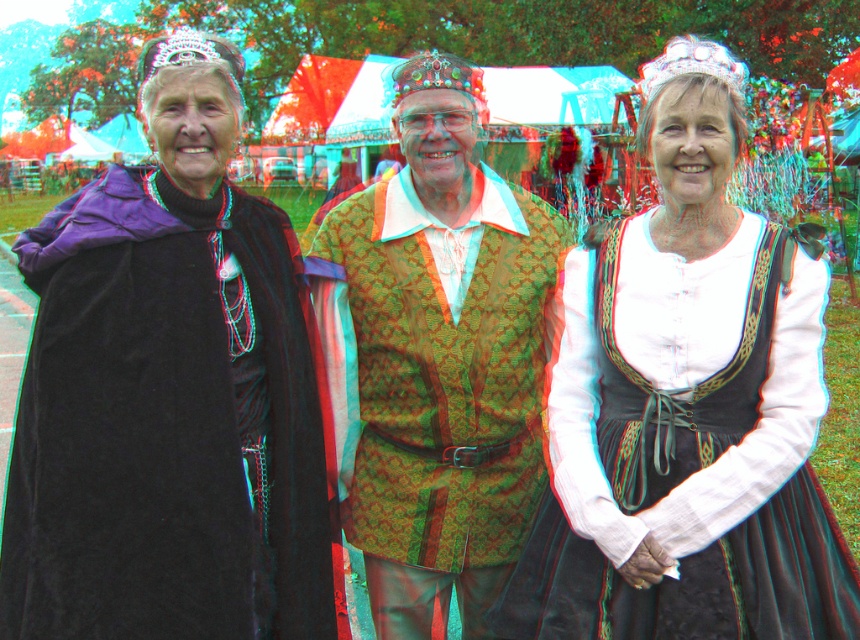
In the scene shown: Does velvet black cape at left appear on the left side of green textured vest at center?

Yes, velvet black cape at left is to the left of green textured vest at center.

In the scene shown: Who is more forward, (x=28, y=605) or (x=498, y=340)?

Point (x=28, y=605) is more forward.

Who is more distant from viewer, (x=230, y=234) or (x=403, y=333)?

The point (x=403, y=333) is behind.

Identify the location of velvet black cape at left. (167, 394).

Between point (668, 529) and point (532, 436), which one is positioned behind?

Point (532, 436)

Is velvet black dress at center to the left of green textured vest at center from the viewer's perspective?

In fact, velvet black dress at center is to the right of green textured vest at center.

Where is `velvet black dress at center`? velvet black dress at center is located at coordinates (686, 408).

Can you confirm if velvet black cape at left is wider than velvet black dress at center?

Incorrect, velvet black cape at left's width does not surpass velvet black dress at center's.

Who is more forward, (84, 248) or (740, 275)?

Point (84, 248) is more forward.

I want to click on velvet black cape at left, so click(x=167, y=394).